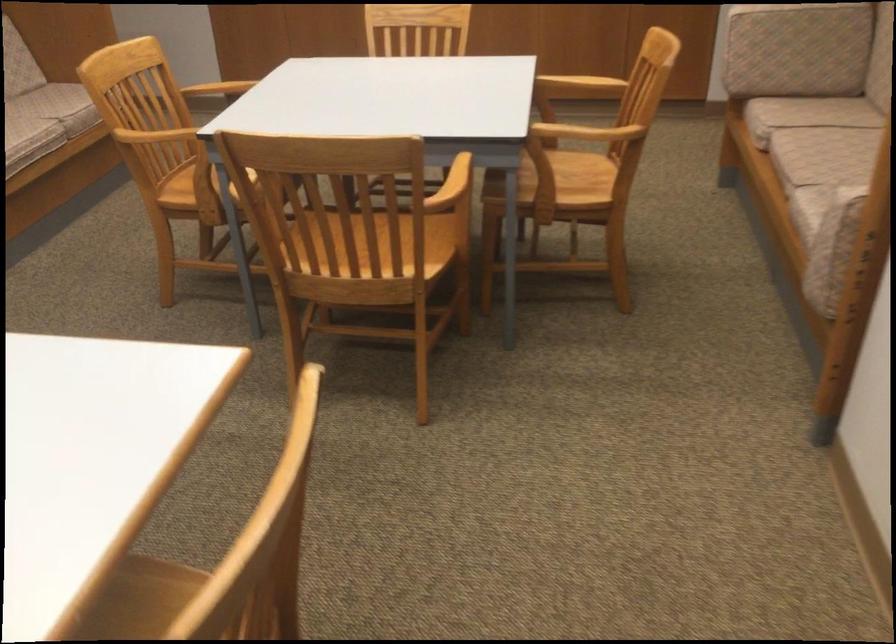
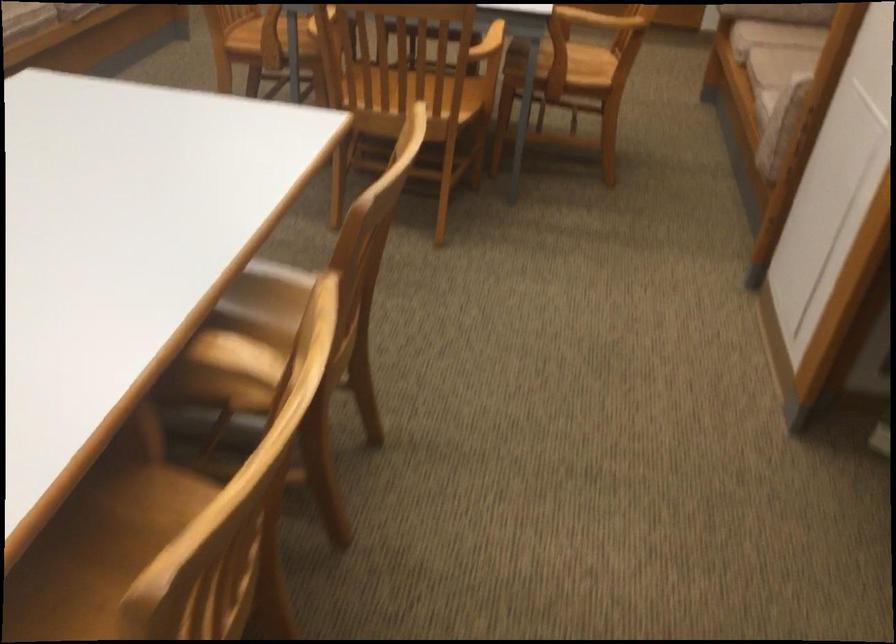
Question: The images are taken continuously from a first-person perspective. In which direction is your viewpoint rotating?

Choices:
 (A) Left
 (B) Right
 (C) Up
 (D) Down

Answer: (D)